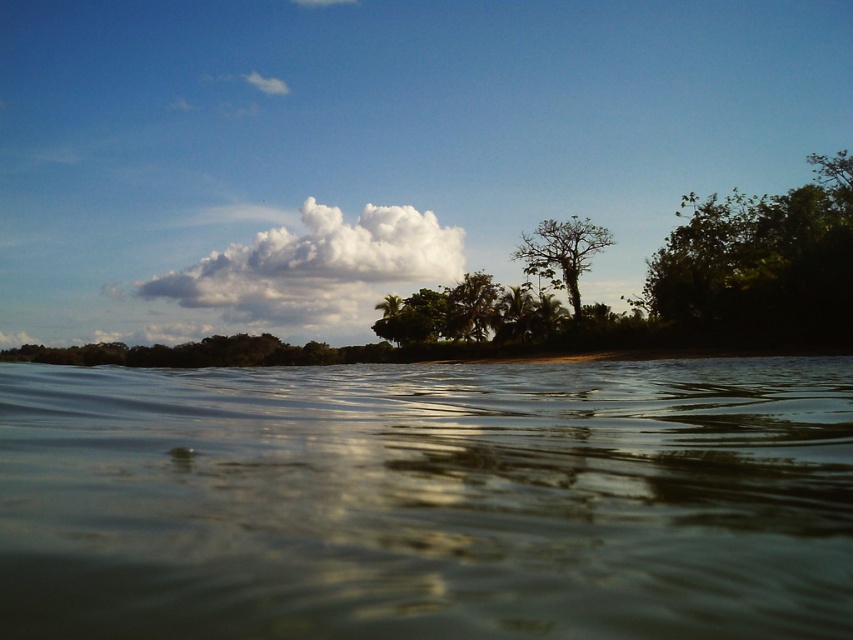
Does brown murky water at center have a larger size compared to white fluffy cloud at center?

Incorrect, brown murky water at center is not larger than white fluffy cloud at center.

Looking at this image, who is taller, brown murky water at center or white fluffy cloud at center?

white fluffy cloud at center

The image size is (853, 640). Identify the location of brown murky water at center. (428, 499).

Is green leafy tree at upper right above white fluffy cloud at center?

Yes.

Who is more forward, (833, 186) or (344, 275)?

Point (833, 186) is more forward.

Locate an element on the screen. The width and height of the screenshot is (853, 640). green leafy tree at upper right is located at coordinates tap(759, 264).

Is brown murky water at center taller than green leafy tree at center?

In fact, brown murky water at center may be shorter than green leafy tree at center.

Between point (727, 461) and point (558, 234), which one is positioned behind?

The point (558, 234) is behind.

Does point (358, 378) come closer to viewer compared to point (577, 276)?

Yes, point (358, 378) is closer to viewer.

Identify the location of brown murky water at center. The height and width of the screenshot is (640, 853). (428, 499).